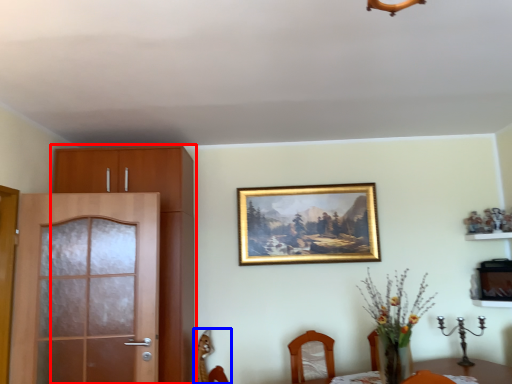
Question: Among these objects, which one is nearest to the camera, cabinetry (highlighted by a red box) or chair (highlighted by a blue box)?

Choices:
 (A) cabinetry
 (B) chair

Answer: (A)